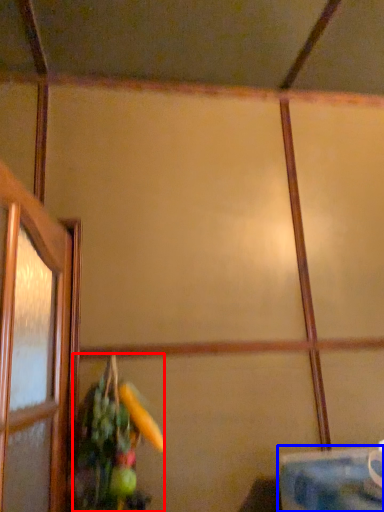
Question: Which point is further to the camera, floral arrangement (highlighted by a red box) or table (highlighted by a blue box)?

Choices:
 (A) floral arrangement
 (B) table

Answer: (A)